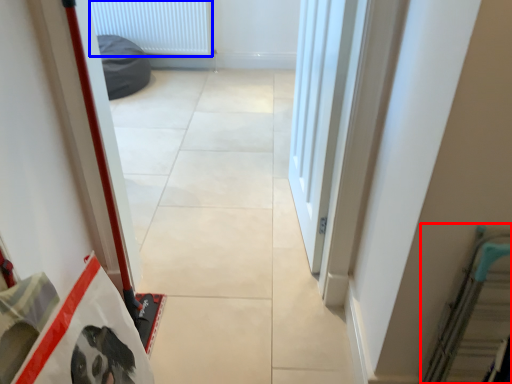
Question: Which point is closer to the camera, escalator (highlighted by a red box) or radiator (highlighted by a blue box)?

Choices:
 (A) escalator
 (B) radiator

Answer: (A)